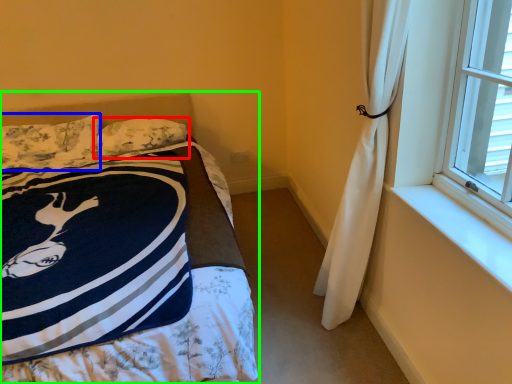
Question: Based on their relative distances, which object is nearer to pillow (highlighted by a red box)? Choose from pillow (highlighted by a blue box) and bed (highlighted by a green box).

Choices:
 (A) pillow
 (B) bed

Answer: (B)